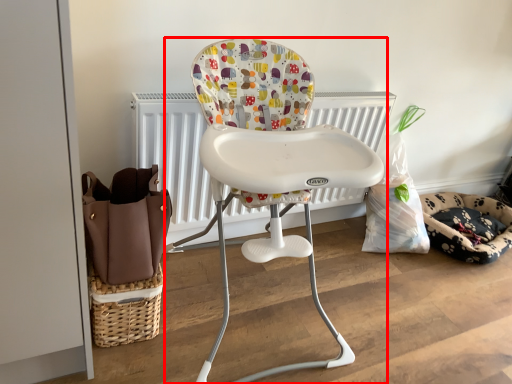
Question: Considering the relative positions of chair (annotated by the red box) and dog bed in the image provided, where is chair (annotated by the red box) located with respect to the staircase?

Choices:
 (A) left
 (B) right

Answer: (A)